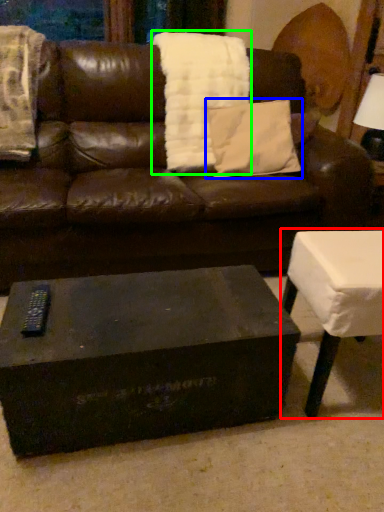
Question: Which object is positioned closest to table (highlighted by a red box)? Select from pillow (highlighted by a blue box) and blanket (highlighted by a green box).

Choices:
 (A) pillow
 (B) blanket

Answer: (A)